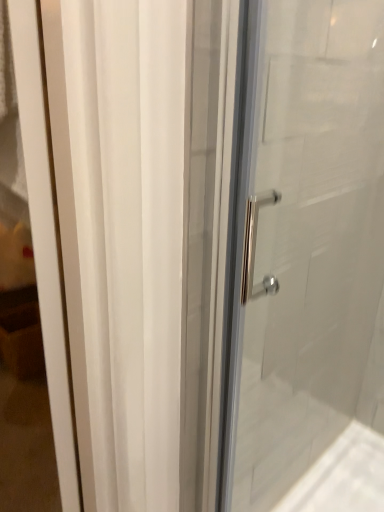
Question: Should I look upward or downward to see polished silver handle at right?

Choices:
 (A) up
 (B) down

Answer: (B)